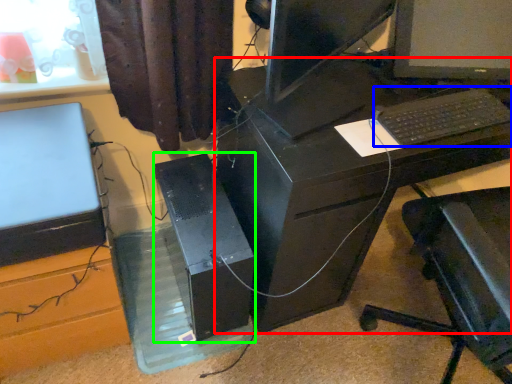
Question: Which object is positioned farthest from desk (highlighted by a red box)? Select from computer keyboard (highlighted by a blue box) and computer tower (highlighted by a green box).

Choices:
 (A) computer keyboard
 (B) computer tower

Answer: (A)